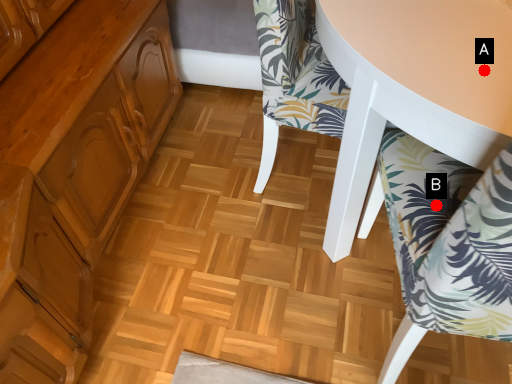
Question: Two points are circled on the image, labeled by A and B beside each circle. Which point is closer to the camera?

Choices:
 (A) A is closer
 (B) B is closer

Answer: (A)